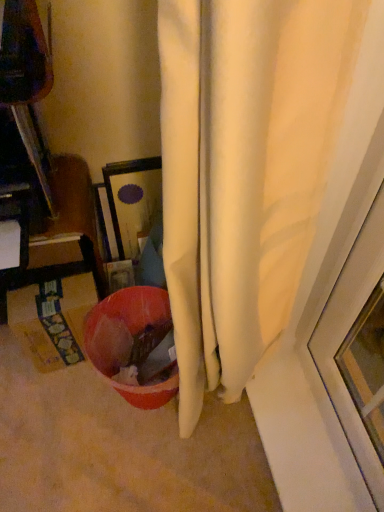
Question: Is yellow cardboard box at lower left thinner than matte plastic bowl at lower center?

Choices:
 (A) yes
 (B) no

Answer: (A)

Question: Is yellow cardboard box at lower left oriented away from matte plastic bowl at lower center?

Choices:
 (A) yes
 (B) no

Answer: (B)

Question: Considering the relative sizes of yellow cardboard box at lower left and matte plastic bowl at lower center in the image provided, is yellow cardboard box at lower left smaller than matte plastic bowl at lower center?

Choices:
 (A) no
 (B) yes

Answer: (B)

Question: Is yellow cardboard box at lower left shorter than matte plastic bowl at lower center?

Choices:
 (A) no
 (B) yes

Answer: (B)

Question: Is yellow cardboard box at lower left touching matte plastic bowl at lower center?

Choices:
 (A) yes
 (B) no

Answer: (B)

Question: From the image's perspective, is yellow cardboard box at lower left above matte plastic bowl at lower center?

Choices:
 (A) no
 (B) yes

Answer: (B)

Question: Is yellow cardboard box at lower left at the back of matte plastic bowl at lower center?

Choices:
 (A) no
 (B) yes

Answer: (A)

Question: Can you confirm if matte plastic bowl at lower center is smaller than yellow cardboard box at lower left?

Choices:
 (A) yes
 (B) no

Answer: (B)

Question: Can you confirm if matte plastic bowl at lower center is positioned to the left of yellow cardboard box at lower left?

Choices:
 (A) yes
 (B) no

Answer: (B)

Question: Is matte plastic bowl at lower center closer to camera compared to yellow cardboard box at lower left?

Choices:
 (A) no
 (B) yes

Answer: (B)

Question: Is matte plastic bowl at lower center to the right of yellow cardboard box at lower left from the viewer's perspective?

Choices:
 (A) no
 (B) yes

Answer: (B)

Question: Can you confirm if matte plastic bowl at lower center is shorter than yellow cardboard box at lower left?

Choices:
 (A) yes
 (B) no

Answer: (B)

Question: Based on their sizes in the image, would you say matte plastic bowl at lower center is bigger or smaller than yellow cardboard box at lower left?

Choices:
 (A) small
 (B) big

Answer: (B)